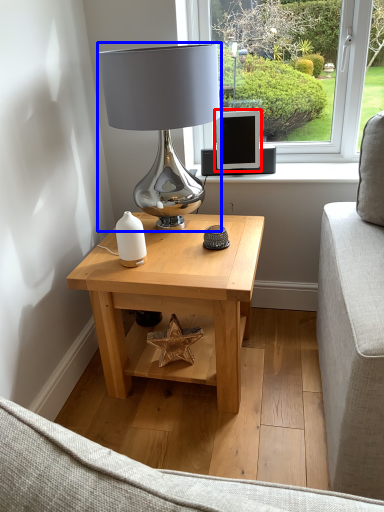
Question: Which object appears farthest to the camera in this image, computer monitor (highlighted by a red box) or table lamp (highlighted by a blue box)?

Choices:
 (A) computer monitor
 (B) table lamp

Answer: (A)